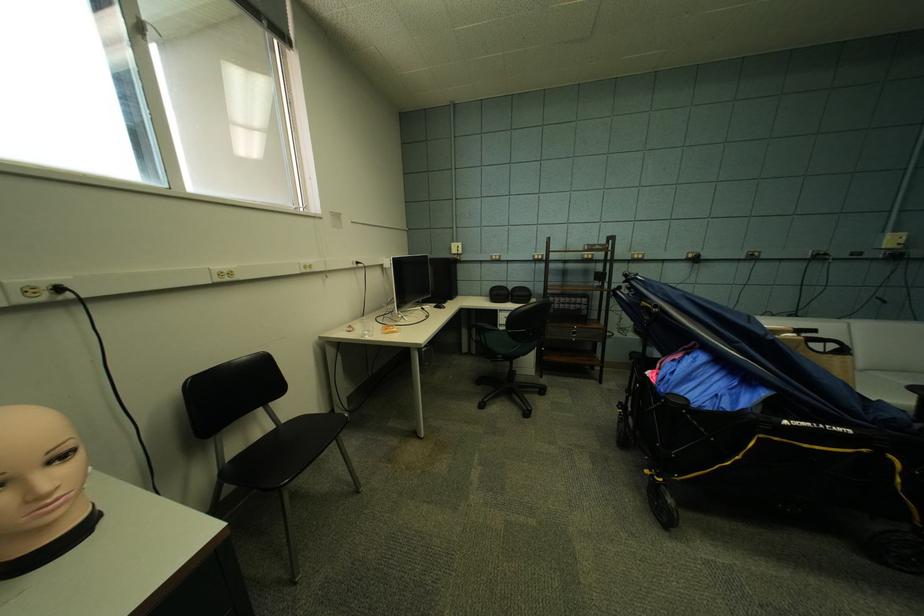
Locate an element on the screen. The height and width of the screenshot is (616, 924). office chair armrest is located at coordinates (482, 330).